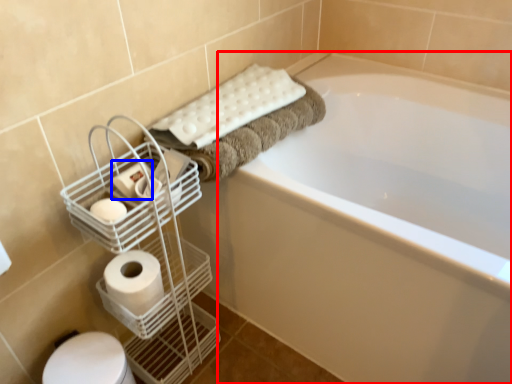
Question: Which object is closer to the camera taking this photo, bathtub (highlighted by a red box) or toilet paper (highlighted by a blue box)?

Choices:
 (A) bathtub
 (B) toilet paper

Answer: (A)